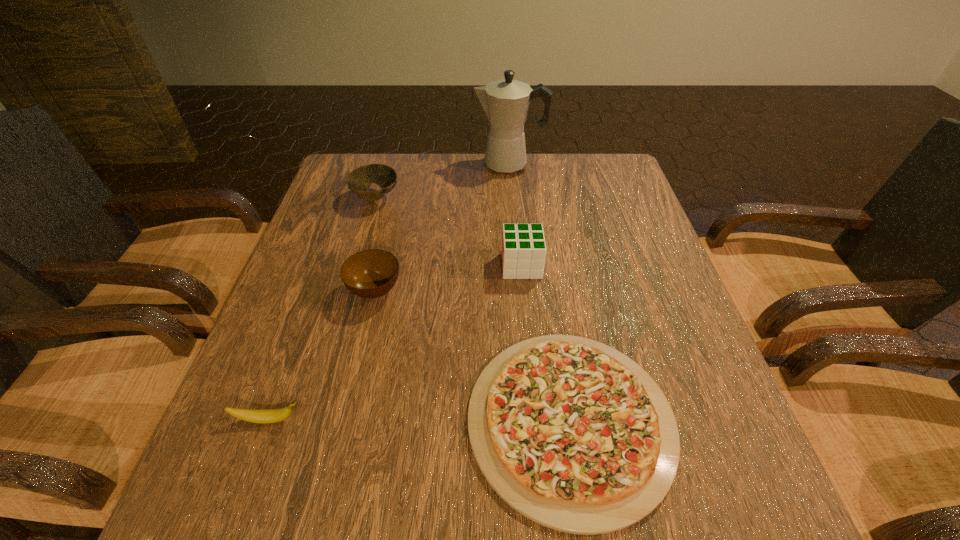
Locate an element on the screen. This screenshot has width=960, height=540. vacant space located on the red face of the second tallest object is located at coordinates (403, 266).

Where is `blank space located on the left of the farther bowl`? blank space located on the left of the farther bowl is located at coordinates (330, 198).

The height and width of the screenshot is (540, 960). Identify the location of vacant area situated on the right of the nearer bowl. (466, 291).

The image size is (960, 540). Identify the location of vacant point located 0.400m at the stem of the banana. (539, 420).

Find the location of `vacant area situated 0.400m on the left of the shortest object`. vacant area situated 0.400m on the left of the shortest object is located at coordinates (235, 421).

The image size is (960, 540). I want to click on coffeepot that is positioned at the far edge, so click(506, 102).

Where is `bowl present at the far edge`? bowl present at the far edge is located at coordinates (359, 181).

At what (x,y) coordinates should I click in order to perform the action: click on object present at the near edge. Please return your answer as a coordinate pair (x, y). The width and height of the screenshot is (960, 540). Looking at the image, I should click on (574, 435).

The width and height of the screenshot is (960, 540). I want to click on banana at the left edge, so click(275, 415).

I want to click on object that is at the right edge, so click(x=574, y=435).